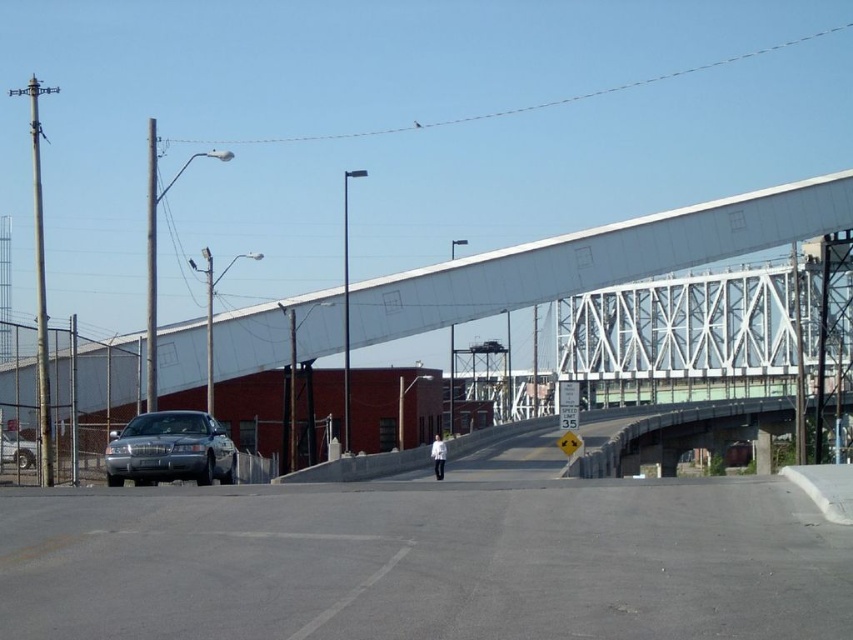
Question: Which is farther from the shiny silver sedan at left?

Choices:
 (A) white matte jacket at center
 (B) satin silver sedan at center

Answer: (A)

Question: Can you confirm if satin silver sedan at center is positioned to the left of white matte jacket at center?

Choices:
 (A) no
 (B) yes

Answer: (B)

Question: Which point is farther to the camera?

Choices:
 (A) shiny silver sedan at left
 (B) white metallic bridge at center
 (C) white matte jacket at center

Answer: (C)

Question: Is satin silver sedan at center to the right of white matte jacket at center from the viewer's perspective?

Choices:
 (A) yes
 (B) no

Answer: (B)

Question: Does satin silver sedan at center come in front of white matte jacket at center?

Choices:
 (A) no
 (B) yes

Answer: (B)

Question: Among these objects, which one is farthest from the camera?

Choices:
 (A) white matte jacket at center
 (B) satin silver sedan at center

Answer: (A)